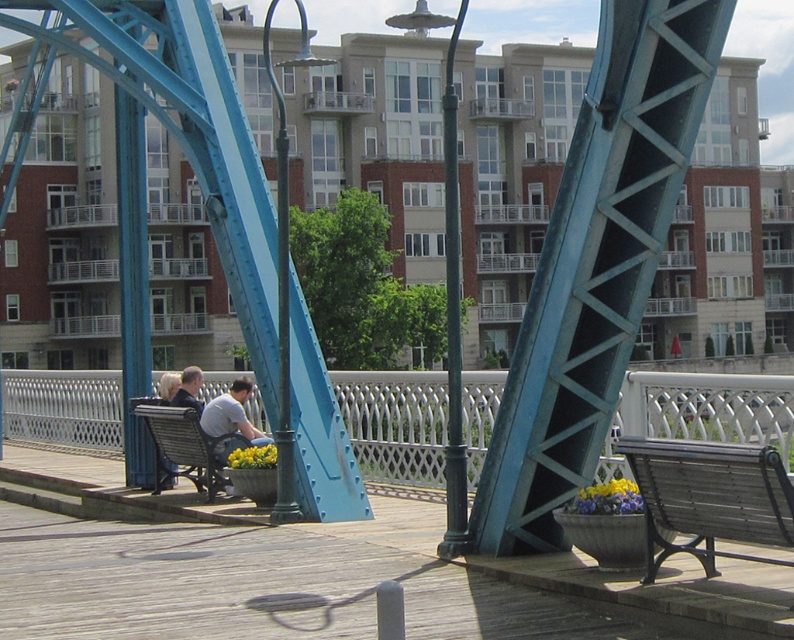
Who is more forward, (461, 502) or (166, 468)?

Point (461, 502)

Can you confirm if green metallic pole at center is smaller than wooden bench at center?

No, green metallic pole at center is not smaller than wooden bench at center.

Image resolution: width=794 pixels, height=640 pixels. I want to click on green metallic pole at center, so click(x=449, y=285).

Between green metal lamp post at center and light gray fabric shirt at center, which one appears on the left side from the viewer's perspective?

Positioned to the left is green metal lamp post at center.

Is the position of green metal lamp post at center more distant than that of light gray fabric shirt at center?

No.

Is point (279, 442) more distant than point (249, 387)?

No, (279, 442) is closer to viewer.

Locate an element on the screen. This screenshot has width=794, height=640. green metal lamp post at center is located at coordinates (280, 305).

Can you confirm if wooden bench at right is thinner than light gray fabric shirt at center?

No, wooden bench at right is not thinner than light gray fabric shirt at center.

Between point (725, 500) and point (232, 394), which one is positioned behind?

Point (232, 394)

Where is `wooden bench at right`? The image size is (794, 640). wooden bench at right is located at coordinates (710, 497).

Where is `wooden bench at right`? The height and width of the screenshot is (640, 794). wooden bench at right is located at coordinates (710, 497).